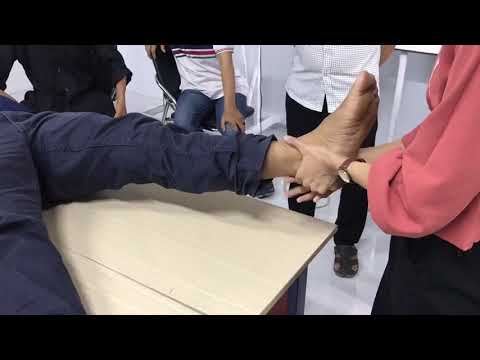
Locate an element on the screen. The width and height of the screenshot is (480, 360). floor is located at coordinates (349, 295).